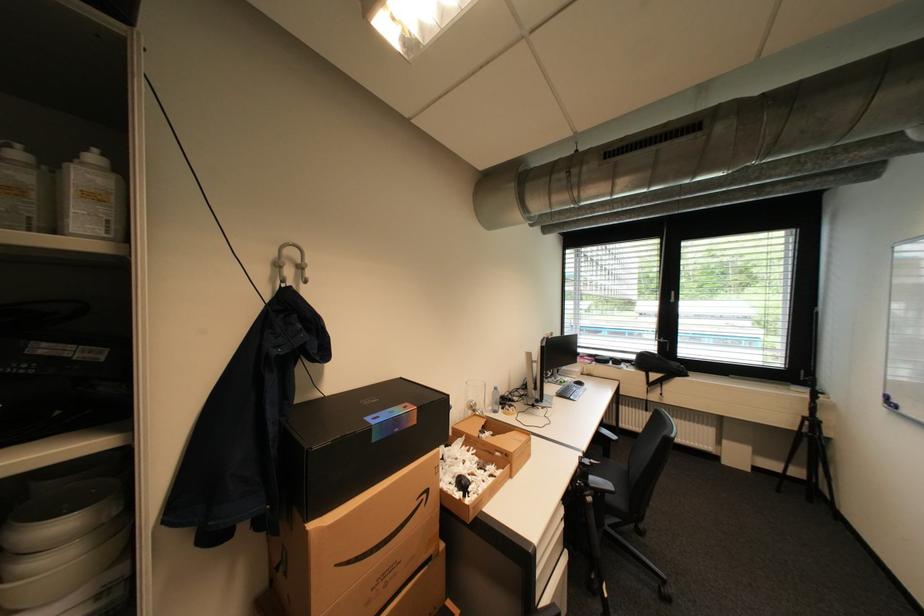
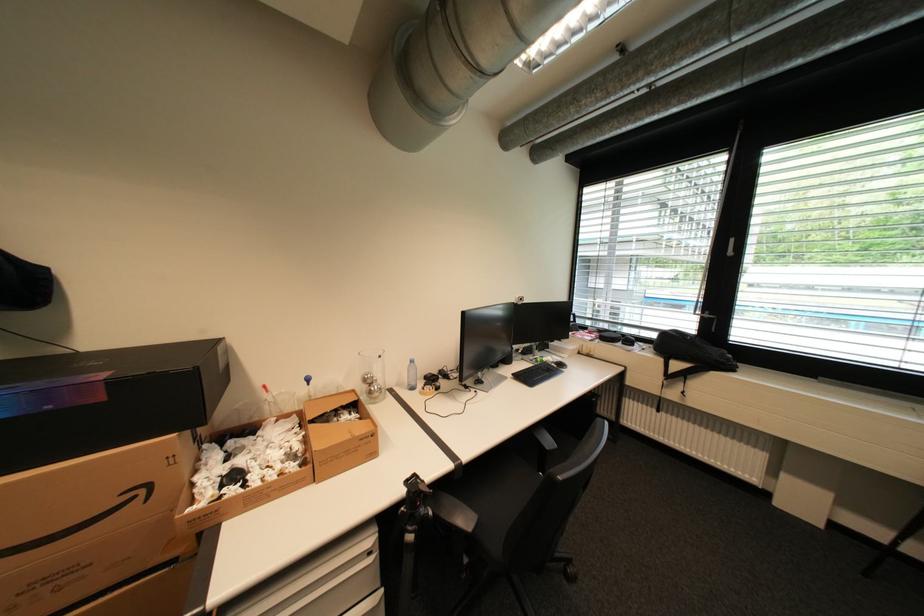
Find the pixel in the second image that matches point 589,463 in the first image.

(416, 484)